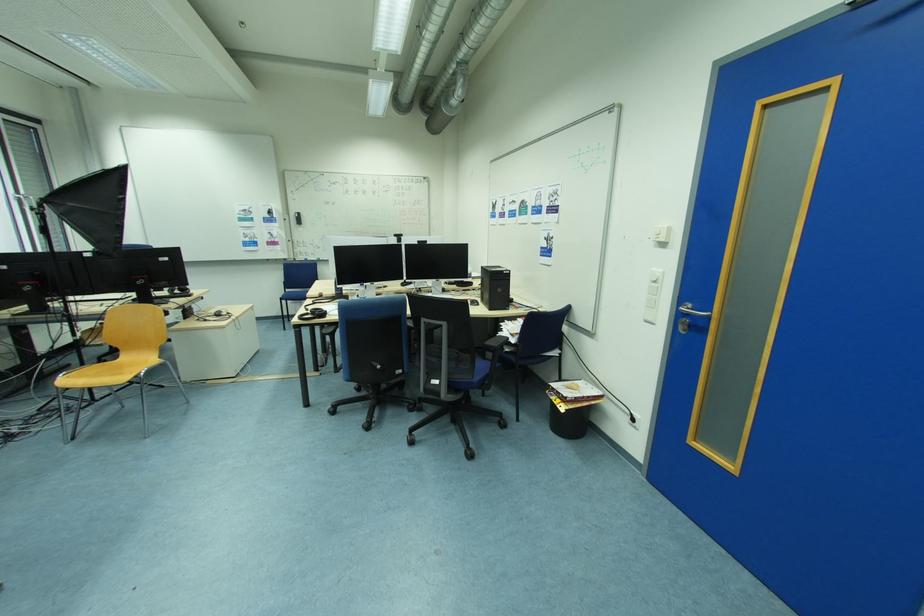
Identify the location of white light switch. (661, 233).